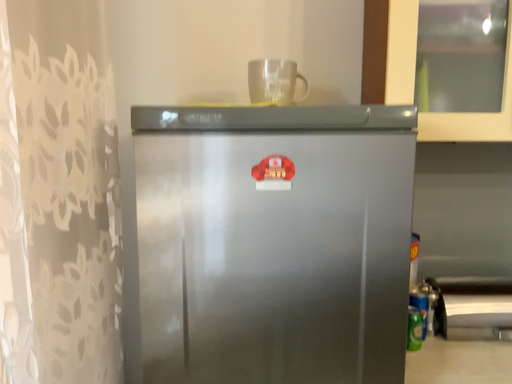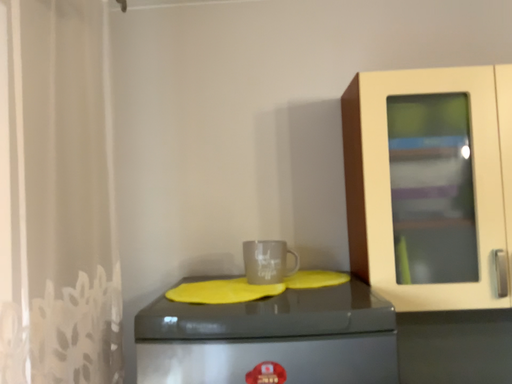
Question: Which way did the camera rotate in the video?

Choices:
 (A) rotated downward
 (B) rotated upward

Answer: (B)